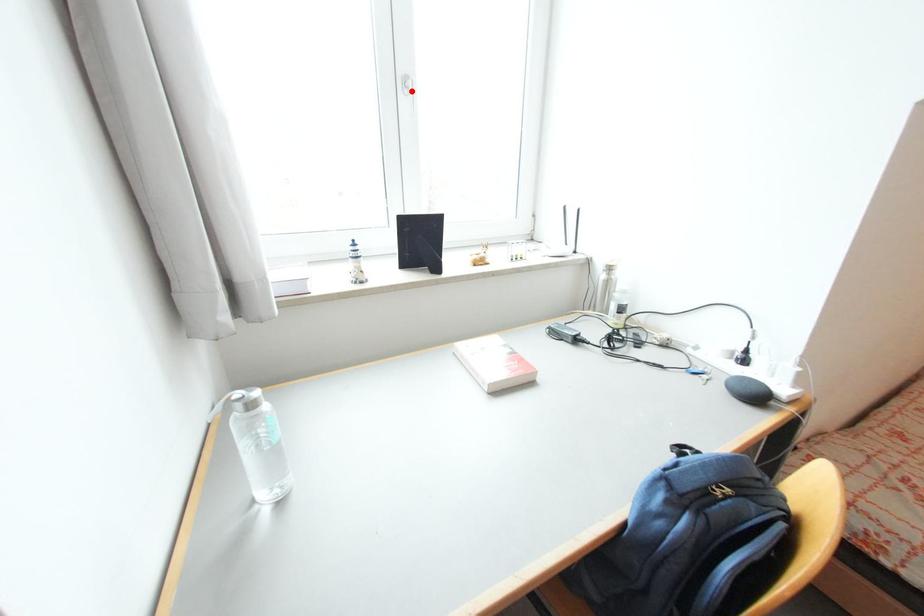
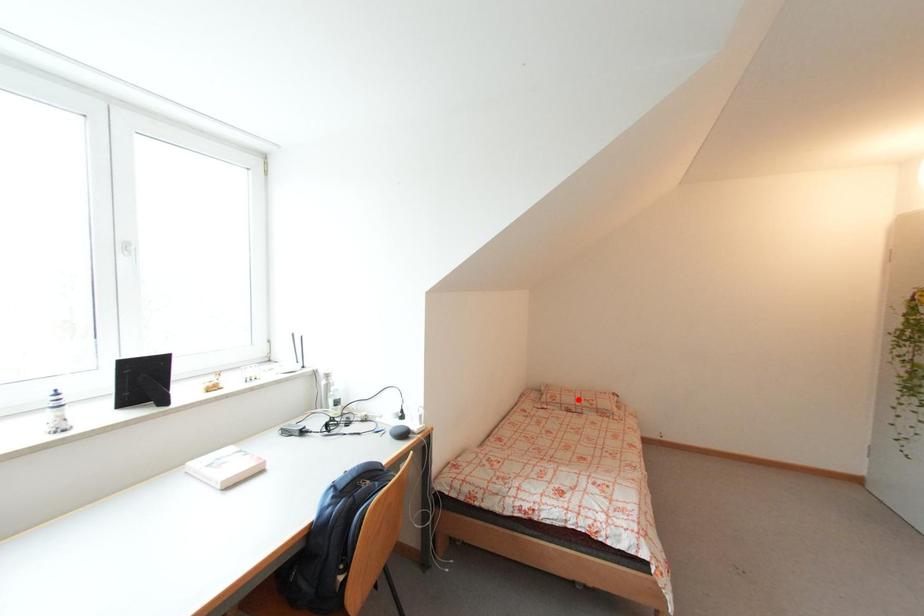
I am providing you with two images of the same scene from different viewpoints. A red point is marked on the first image and another point is marked on the second image. Is the marked point in image1 the same physical position as the marked point in image2?

No